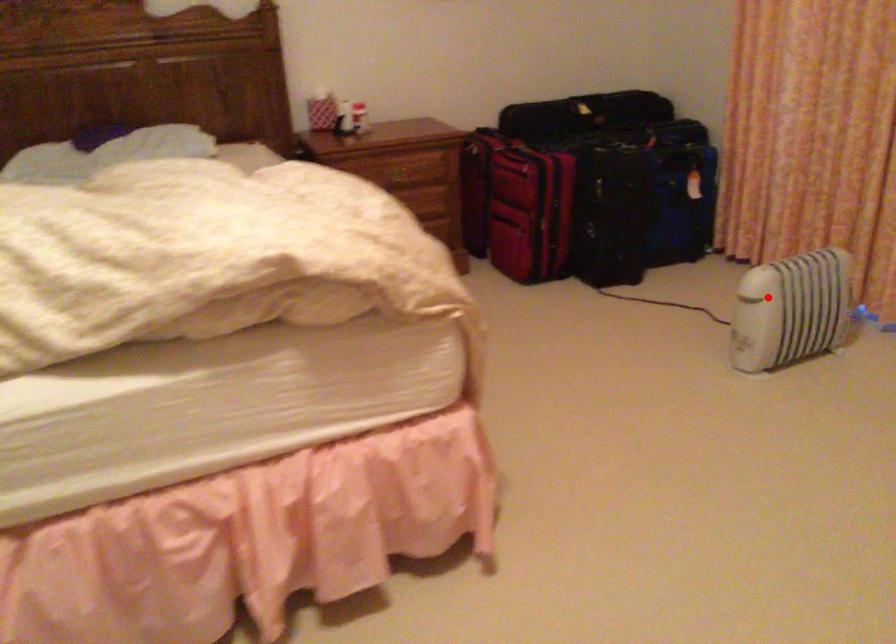
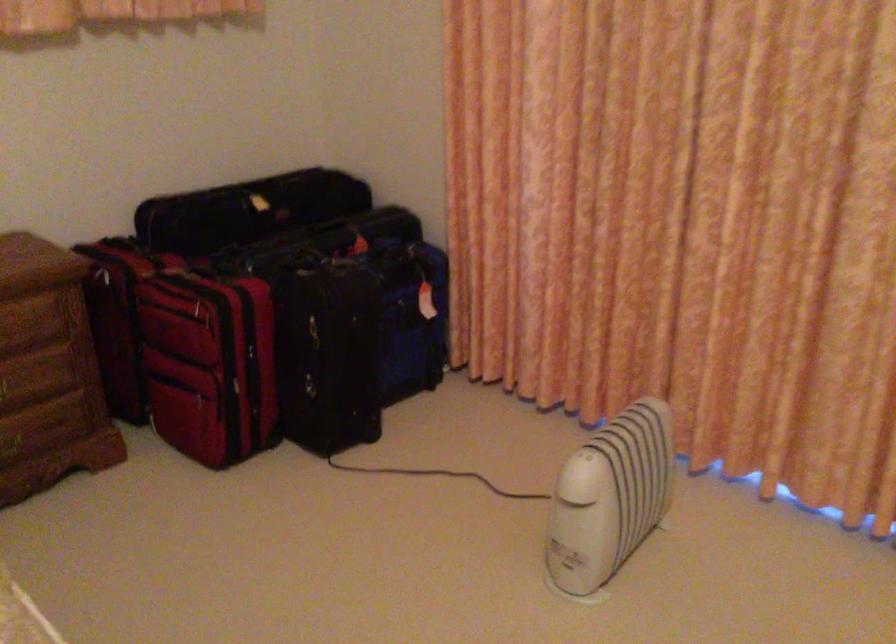
Locate, in the second image, the point that corresponds to the highlighted location in the first image.

(609, 498)